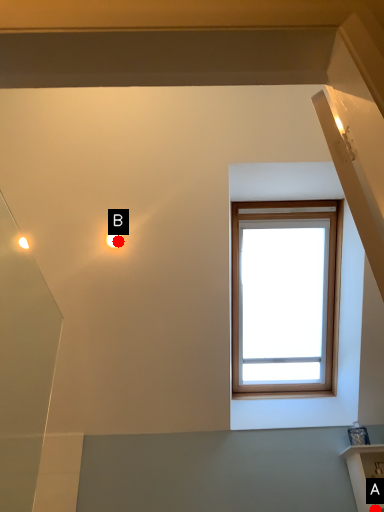
Question: Two points are circled on the image, labeled by A and B beside each circle. Among these points, which one is nearest to the camera?

Choices:
 (A) A is closer
 (B) B is closer

Answer: (A)